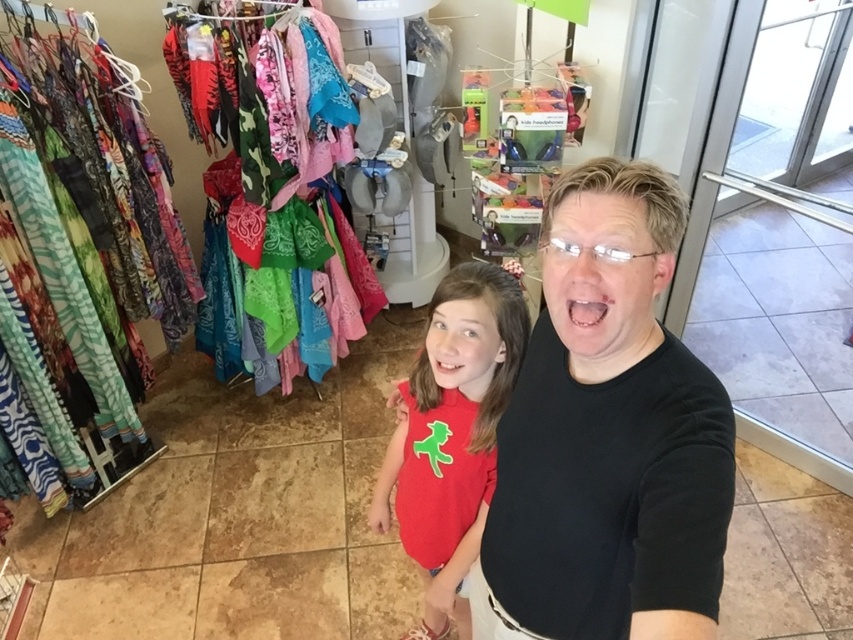
Who is positioned more to the left, black matte t-shirt at center or matte red t-shirt at center?

matte red t-shirt at center is more to the left.

Who is taller, black matte t-shirt at center or matte red t-shirt at center?

matte red t-shirt at center is taller.

Who is more distant from viewer, (631, 541) or (405, 461)?

The point (405, 461) is behind.

The width and height of the screenshot is (853, 640). Find the location of `black matte t-shirt at center`. black matte t-shirt at center is located at coordinates (607, 435).